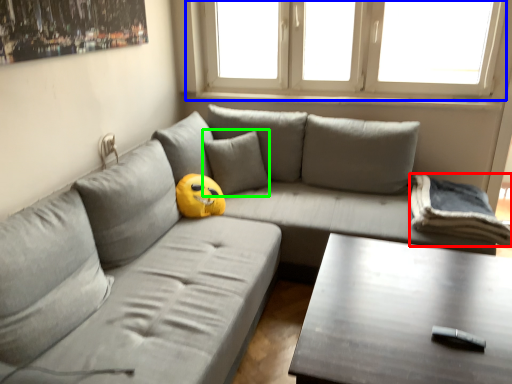
Question: Based on their relative distances, which object is nearer to pillow (highlighted by a red box)? Choose from window (highlighted by a blue box) and pillow (highlighted by a green box).

Choices:
 (A) window
 (B) pillow

Answer: (B)